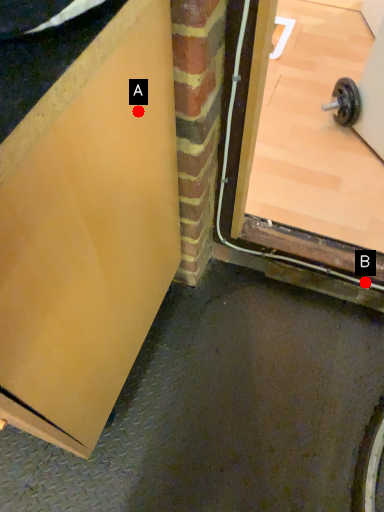
Question: Two points are circled on the image, labeled by A and B beside each circle. Which point is farther from the camera taking this photo?

Choices:
 (A) A is further
 (B) B is further

Answer: (B)